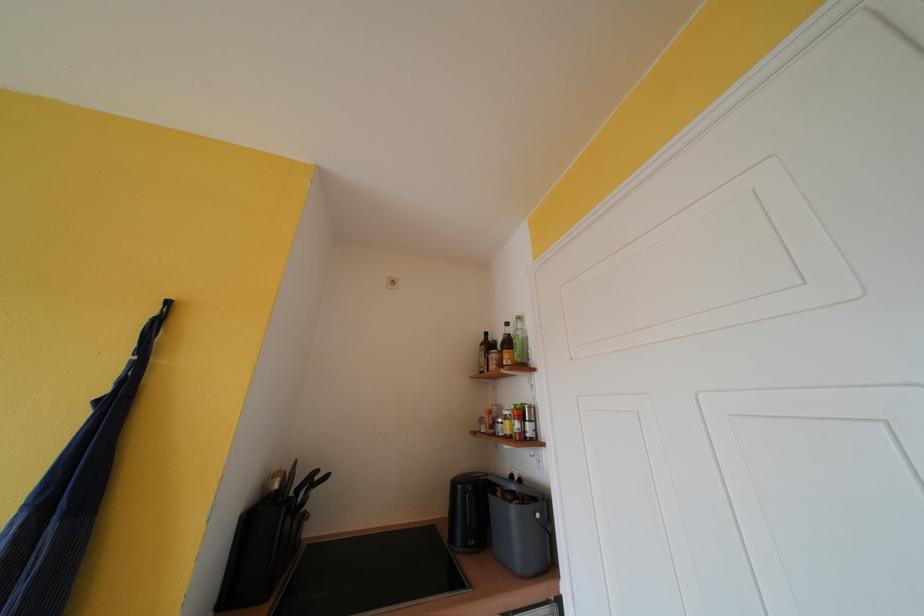
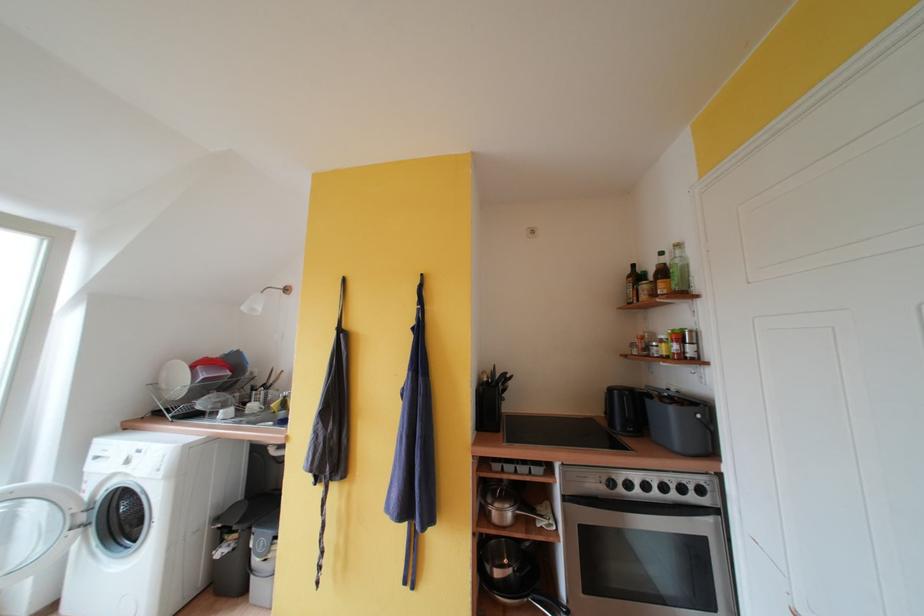
Locate, in the second image, the point that corresponds to pixel 488 349 in the first image.

(634, 281)